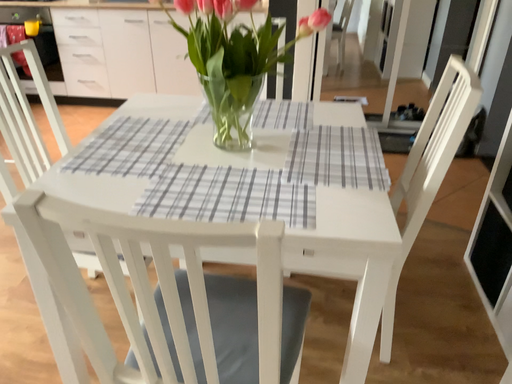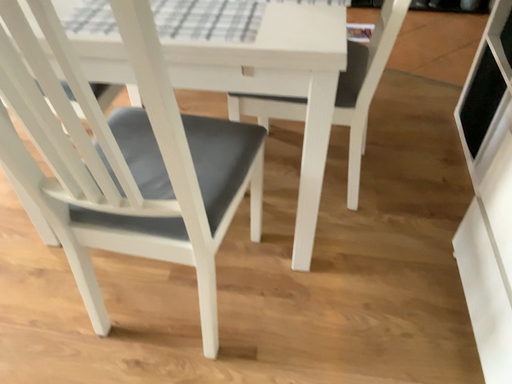
Question: How did the camera likely rotate when shooting the video?

Choices:
 (A) rotated downward
 (B) rotated upward

Answer: (A)